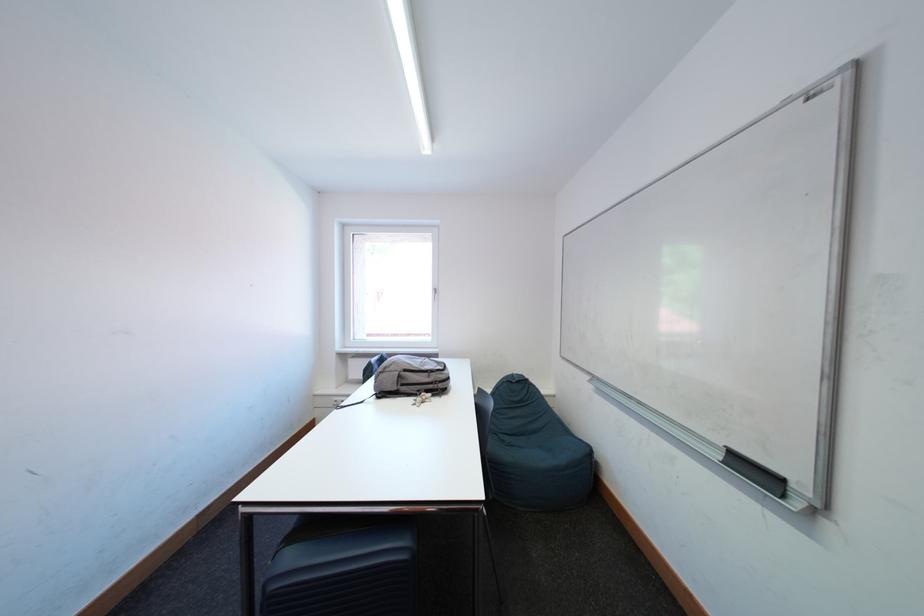
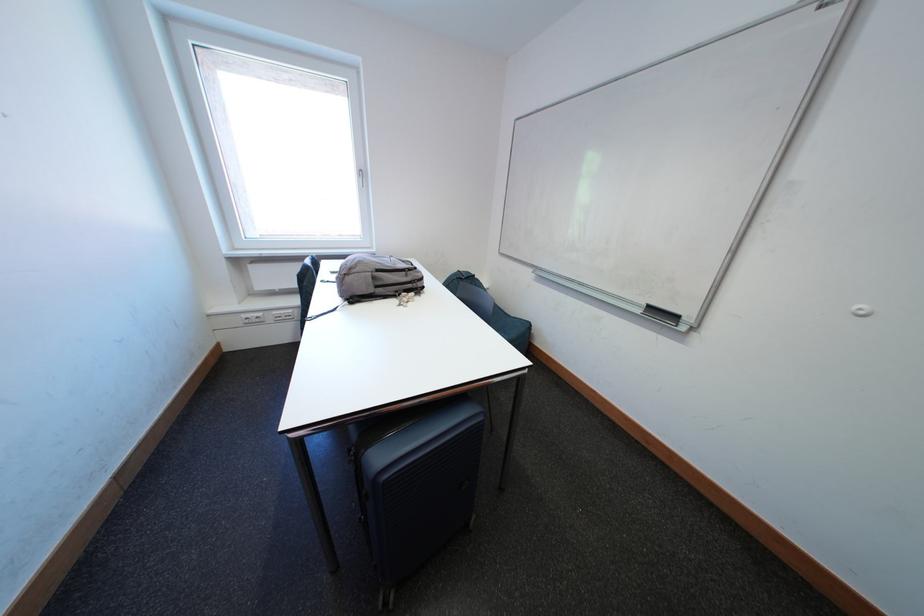
In the second image, find the point that corresponds to point (727, 461) in the first image.

(649, 315)